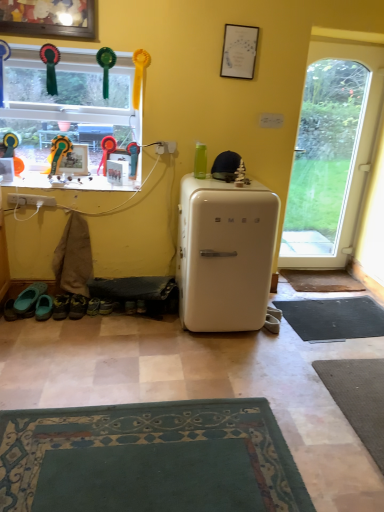
This screenshot has height=512, width=384. In order to click on empty space that is ontop of brown textured mat at lower right (from a real-world perspective) in this screenshot , I will do `click(323, 279)`.